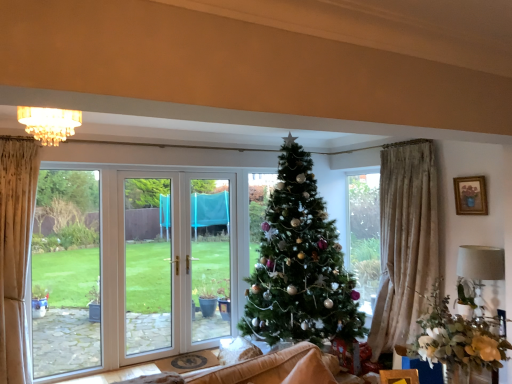
Question: From a real-world perspective, does crystal chandelier at upper center stand above green matte christmas tree at center?

Choices:
 (A) no
 (B) yes

Answer: (B)

Question: From a real-world perspective, is crystal chandelier at upper center located beneath green matte christmas tree at center?

Choices:
 (A) yes
 (B) no

Answer: (B)

Question: Does crystal chandelier at upper center appear on the right side of green matte christmas tree at center?

Choices:
 (A) no
 (B) yes

Answer: (A)

Question: Is green matte christmas tree at center surrounded by crystal chandelier at upper center?

Choices:
 (A) no
 (B) yes

Answer: (A)

Question: Is crystal chandelier at upper center thinner than green matte christmas tree at center?

Choices:
 (A) no
 (B) yes

Answer: (B)

Question: Is wooden framed picture at upper right spatially inside wooden box at lower right, or outside of it?

Choices:
 (A) outside
 (B) inside

Answer: (A)

Question: From the image's perspective, is wooden framed picture at upper right located above or below wooden box at lower right?

Choices:
 (A) above
 (B) below

Answer: (A)

Question: Is wooden framed picture at upper right in front of or behind wooden box at lower right in the image?

Choices:
 (A) front
 (B) behind

Answer: (B)

Question: Considering the relative positions of wooden framed picture at upper right and wooden box at lower right in the image provided, is wooden framed picture at upper right to the left or to the right of wooden box at lower right?

Choices:
 (A) right
 (B) left

Answer: (A)

Question: Would you say wooden box at lower right is inside or outside crystal chandelier at upper center?

Choices:
 (A) outside
 (B) inside

Answer: (A)

Question: Would you say wooden box at lower right is to the left or to the right of crystal chandelier at upper center in the picture?

Choices:
 (A) right
 (B) left

Answer: (A)

Question: Is point (397, 375) positioned closer to the camera than point (75, 117)?

Choices:
 (A) closer
 (B) farther

Answer: (B)

Question: Considering the positions of wooden box at lower right and crystal chandelier at upper center in the image, is wooden box at lower right wider or thinner than crystal chandelier at upper center?

Choices:
 (A) thin
 (B) wide

Answer: (A)

Question: In terms of width, does wooden framed picture at upper right look wider or thinner when compared to crystal chandelier at upper center?

Choices:
 (A) thin
 (B) wide

Answer: (A)

Question: Considering the relative positions of wooden framed picture at upper right and crystal chandelier at upper center in the image provided, is wooden framed picture at upper right to the left or to the right of crystal chandelier at upper center?

Choices:
 (A) left
 (B) right

Answer: (B)